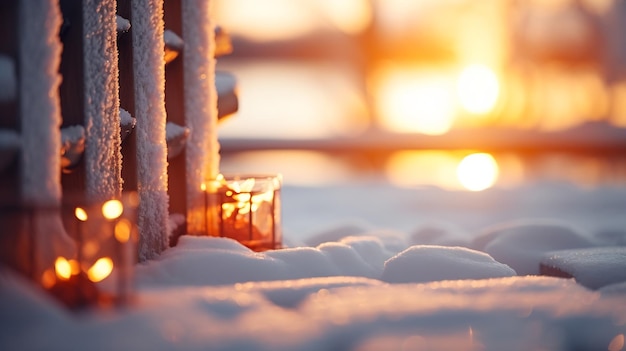
Image resolution: width=626 pixels, height=351 pixels. Find the location of `black frames`. black frames is located at coordinates (104, 253), (258, 210).